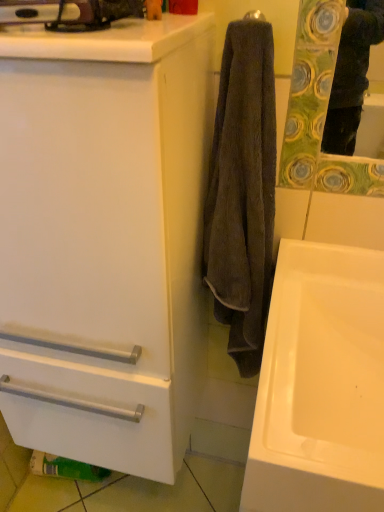
Question: Does white glossy sink at lower right have a lesser width compared to white matte cabinet at center?

Choices:
 (A) yes
 (B) no

Answer: (B)

Question: Are white glossy sink at lower right and white matte cabinet at center beside each other?

Choices:
 (A) yes
 (B) no

Answer: (B)

Question: Is white glossy sink at lower right to the right of white matte cabinet at center from the viewer's perspective?

Choices:
 (A) no
 (B) yes

Answer: (B)

Question: Does white glossy sink at lower right come behind white matte cabinet at center?

Choices:
 (A) no
 (B) yes

Answer: (B)

Question: Is white glossy sink at lower right oriented towards white matte cabinet at center?

Choices:
 (A) yes
 (B) no

Answer: (B)

Question: Is white glossy sink at lower right bigger than white matte cabinet at center?

Choices:
 (A) no
 (B) yes

Answer: (A)

Question: Can you confirm if dark brown towel at center is positioned to the right of white glossy sink at lower right?

Choices:
 (A) yes
 (B) no

Answer: (B)

Question: Is dark brown towel at center positioned far away from white glossy sink at lower right?

Choices:
 (A) yes
 (B) no

Answer: (B)

Question: Can you confirm if dark brown towel at center is positioned to the left of white glossy sink at lower right?

Choices:
 (A) yes
 (B) no

Answer: (A)

Question: Is dark brown towel at center thinner than white glossy sink at lower right?

Choices:
 (A) yes
 (B) no

Answer: (A)

Question: Would you say white glossy sink at lower right is part of dark brown towel at center's contents?

Choices:
 (A) yes
 (B) no

Answer: (B)

Question: Does dark brown towel at center turn towards white glossy sink at lower right?

Choices:
 (A) no
 (B) yes

Answer: (A)

Question: Can you confirm if dark brown towel at center is smaller than white matte cabinet at center?

Choices:
 (A) yes
 (B) no

Answer: (A)